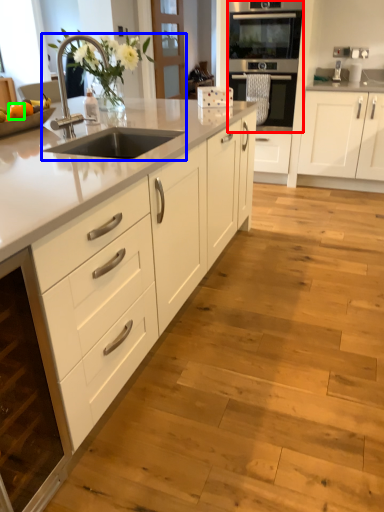
Question: Estimate the real-world distances between objects in this image. Which object is farther from oven (highlighted by a red box), sink (highlighted by a blue box) or orange (highlighted by a green box)?

Choices:
 (A) sink
 (B) orange

Answer: (B)